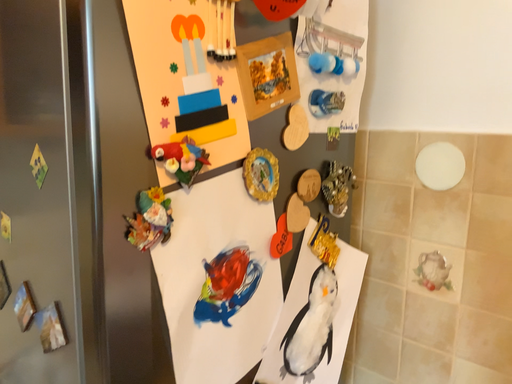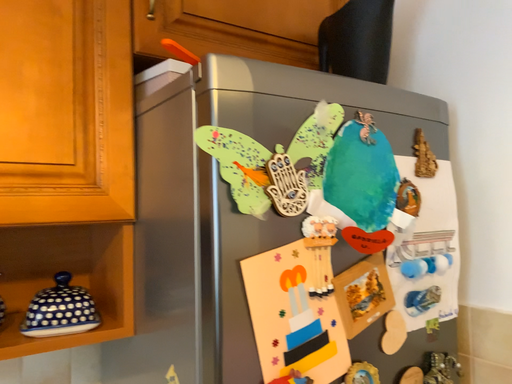
Question: Which way did the camera rotate in the video?

Choices:
 (A) rotated right
 (B) rotated left

Answer: (B)